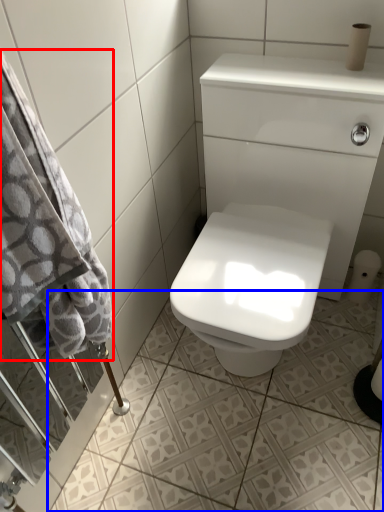
Question: Which object appears farthest to the camera in this image, bath towel (highlighted by a red box) or ceramic tile (highlighted by a blue box)?

Choices:
 (A) bath towel
 (B) ceramic tile

Answer: (B)